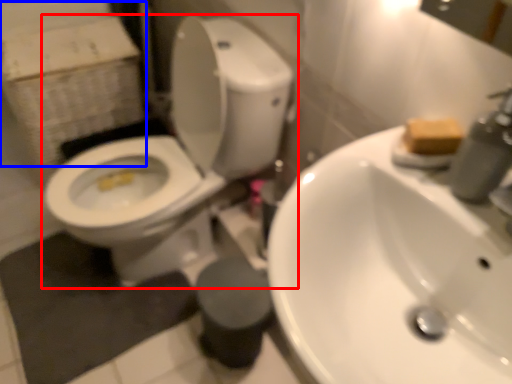
Question: Which point is closer to the camera, toilet (highlighted by a red box) or cardboard box (highlighted by a blue box)?

Choices:
 (A) toilet
 (B) cardboard box

Answer: (A)